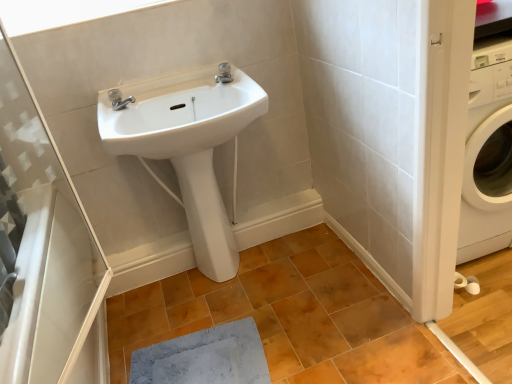
Question: In terms of width, does blue soft mat at lower center look wider or thinner when compared to transparent plastic shower door at left?

Choices:
 (A) wide
 (B) thin

Answer: (A)

Question: Is point (210, 336) closer or farther from the camera than point (36, 344)?

Choices:
 (A) closer
 (B) farther

Answer: (B)

Question: Estimate the real-world distances between objects in this image. Which object is farther from the white glossy sink at upper center?

Choices:
 (A) brown matte tile at center
 (B) blue soft mat at lower center
 (C) satin nickel faucet at upper center, which is the 1th tap in right-to-left order
 (D) polished chrome faucet at upper center, the first tap from the bottom
 (E) white glossy bidet at center

Answer: (B)

Question: Which object is positioned closest to the white matte window at upper left?

Choices:
 (A) polished chrome faucet at upper center, the first tap from the bottom
 (B) white glossy sink at upper center
 (C) brown matte tile at center
 (D) satin nickel faucet at upper center, which is the 1th tap in right-to-left order
 (E) transparent plastic shower door at left

Answer: (A)